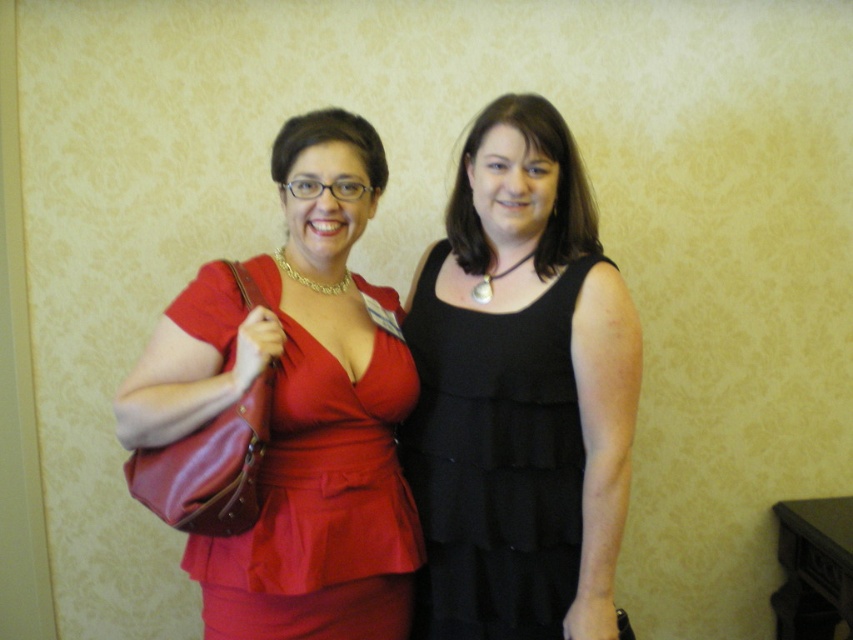
Question: Can you confirm if black matte dress at center is bigger than matte red dress at left?

Choices:
 (A) yes
 (B) no

Answer: (B)

Question: Which point appears farthest from the camera in this image?

Choices:
 (A) (451, 378)
 (B) (286, 330)

Answer: (A)

Question: Which point appears farthest from the camera in this image?

Choices:
 (A) (282, 588)
 (B) (469, 566)

Answer: (B)

Question: Is black matte dress at center above matte red dress at left?

Choices:
 (A) no
 (B) yes

Answer: (B)

Question: Is black matte dress at center above matte red dress at left?

Choices:
 (A) no
 (B) yes

Answer: (B)

Question: Among these objects, which one is nearest to the camera?

Choices:
 (A) black matte dress at center
 (B) matte red dress at left

Answer: (B)